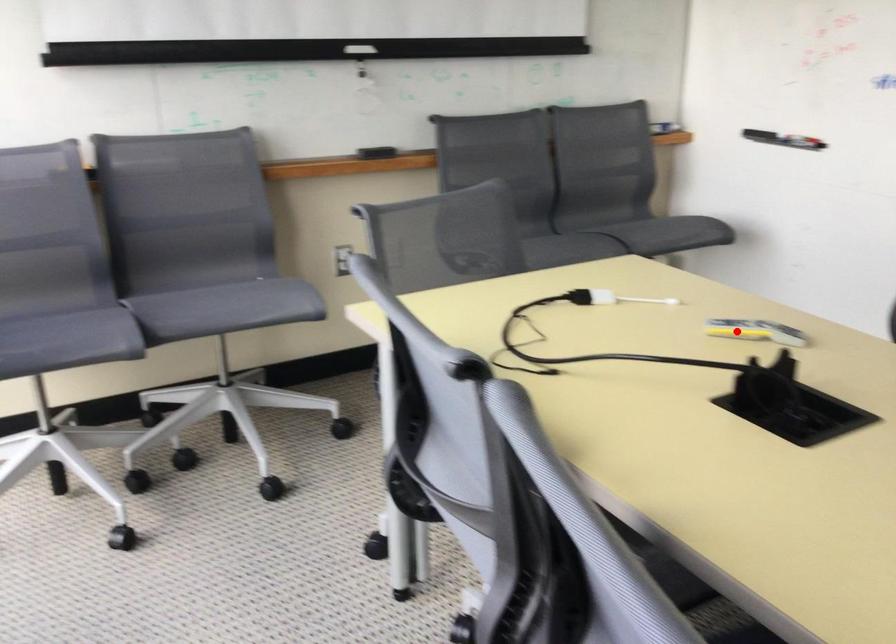
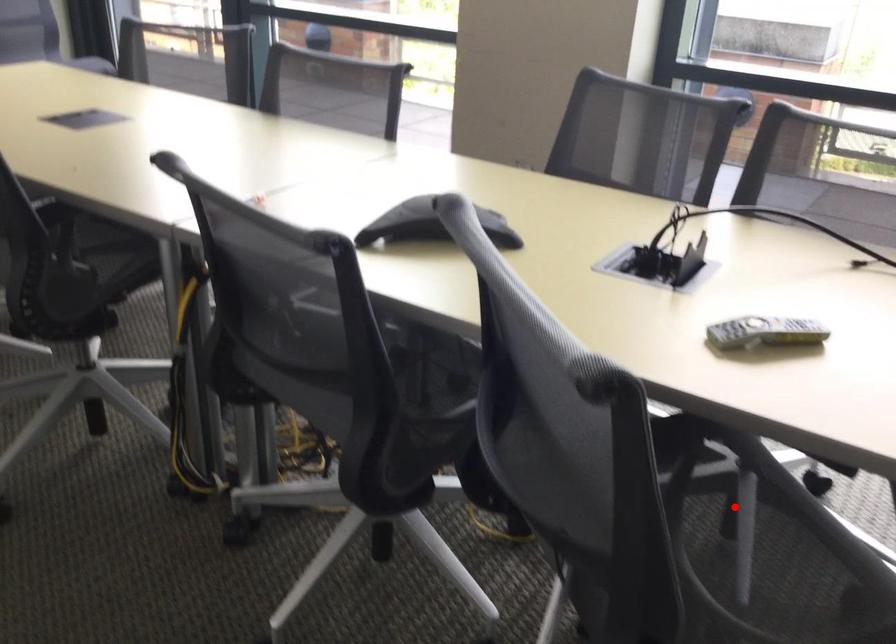
I am providing you with two images of the same scene from different viewpoints. A red point is marked on the first image and another point is marked on the second image. Do the highlighted points in image1 and image2 indicate the same real-world spot?

No